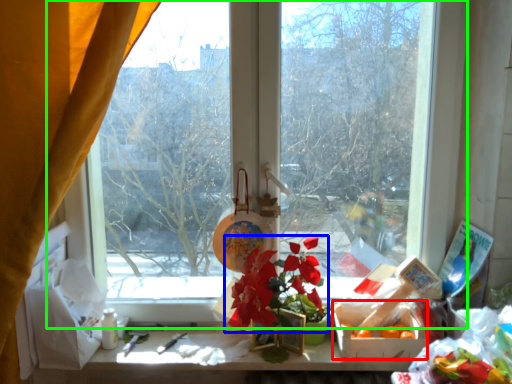
Question: Which object is positioned closest to flower box (highlighted by a red box)? Select from flower (highlighted by a blue box) and window (highlighted by a green box).

Choices:
 (A) flower
 (B) window

Answer: (A)